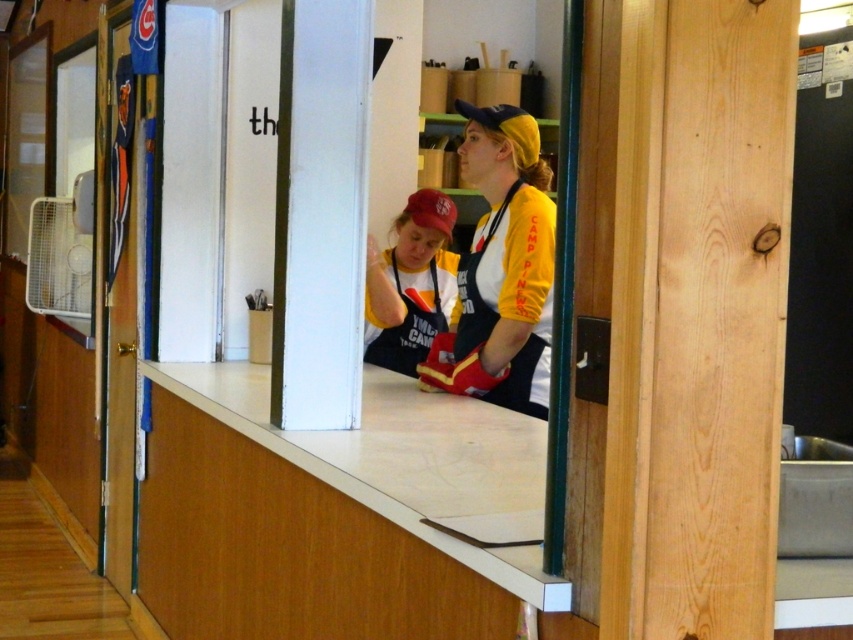
Question: Among these objects, which one is farthest from the camera?

Choices:
 (A) matte red baseball cap at center
 (B) yellow matte apron at center

Answer: (A)

Question: Is yellow matte apron at center closer to camera compared to matte red baseball cap at center?

Choices:
 (A) no
 (B) yes

Answer: (B)

Question: Which point is farther to the camera?

Choices:
 (A) (442, 221)
 (B) (497, 323)
 (C) (505, 108)

Answer: (A)

Question: Which object appears closest to the camera in this image?

Choices:
 (A) yellow matte baseball cap at upper center
 (B) matte red cap at center

Answer: (A)

Question: Does matte red cap at center appear under matte red baseball cap at center?

Choices:
 (A) no
 (B) yes

Answer: (B)

Question: Is matte red cap at center positioned in front of matte red baseball cap at center?

Choices:
 (A) no
 (B) yes

Answer: (B)